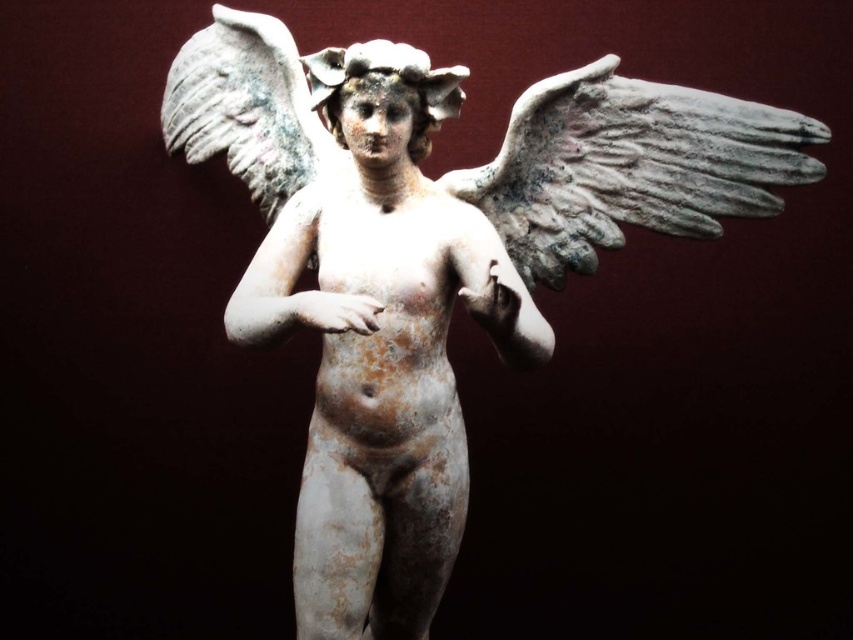
You are an art restorer examining the classical sculpture. The white stone cherub at center and the white stone wing at center are both part of the same sculpture. Which part of the sculpture is wider?

The white stone wing at center is wider than the white stone cherub at center.

You are an art conservator examining the sculpture. You notice two points on the sculpture at coordinates point [293,54] and point [540,90]. Which point is closer to the front of the sculpture?

Point [540,90] is closer to the front of the sculpture because it is in front of point [293,54].

You are standing in front of the sculpture and want to touch the point at coordinates point [369,140]. If your arm can reach 5 feet, can you reach it?

The point [369,140] is 5.39 feet from the viewer. Since your arm can only reach 5 feet, you cannot reach it.